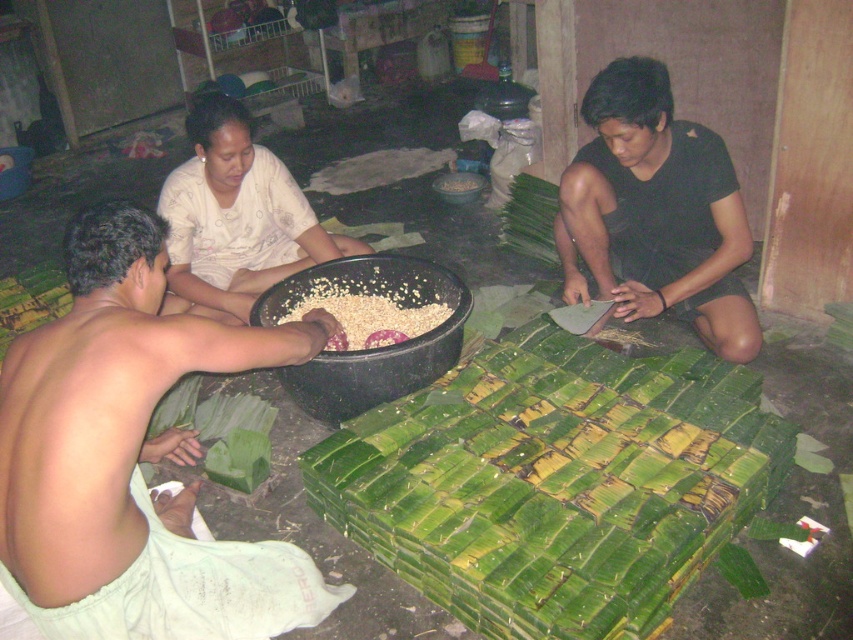
Question: Is white fabric at center to the left of white grainy rice at center from the viewer's perspective?

Choices:
 (A) yes
 (B) no

Answer: (A)

Question: Which point is farther to the camera?

Choices:
 (A) light green fabric at lower left
 (B) green leafy bundle at center
 (C) white grainy rice at center
 (D) white fabric at center

Answer: (D)

Question: Does green leafy bundle at center have a lesser width compared to white grainy rice at center?

Choices:
 (A) no
 (B) yes

Answer: (A)

Question: Which point is closer to the camera taking this photo?

Choices:
 (A) (252, 168)
 (B) (531, 550)

Answer: (B)

Question: Which point appears closest to the camera in this image?

Choices:
 (A) (482, 513)
 (B) (427, 324)
 (C) (262, 266)
 (D) (601, 84)

Answer: (A)

Question: Can you confirm if light green fabric at lower left is positioned to the right of black matte shirt at center?

Choices:
 (A) yes
 (B) no

Answer: (B)